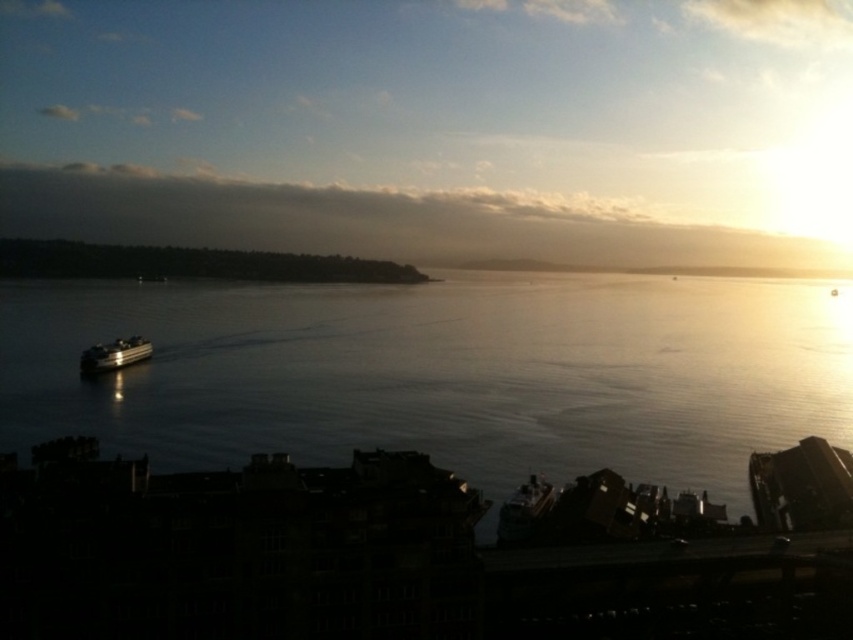
Question: Can you confirm if clear water at center is positioned to the right of shiny silver ferry at lower left?

Choices:
 (A) yes
 (B) no

Answer: (A)

Question: Which object is closer to the camera taking this photo?

Choices:
 (A) clear water at center
 (B) shiny silver ferry at lower left

Answer: (A)

Question: Which object appears farthest from the camera in this image?

Choices:
 (A) shiny silver ferry at lower left
 (B) clear water at center

Answer: (A)

Question: Is clear water at center below shiny silver ferry at lower left?

Choices:
 (A) yes
 (B) no

Answer: (B)

Question: Is clear water at center further to the viewer compared to shiny silver ferry at lower left?

Choices:
 (A) yes
 (B) no

Answer: (B)